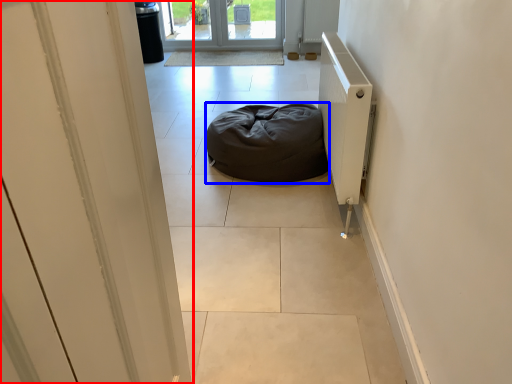
Question: Which object appears closest to the camera in this image, door (highlighted by a red box) or furniture (highlighted by a blue box)?

Choices:
 (A) door
 (B) furniture

Answer: (A)